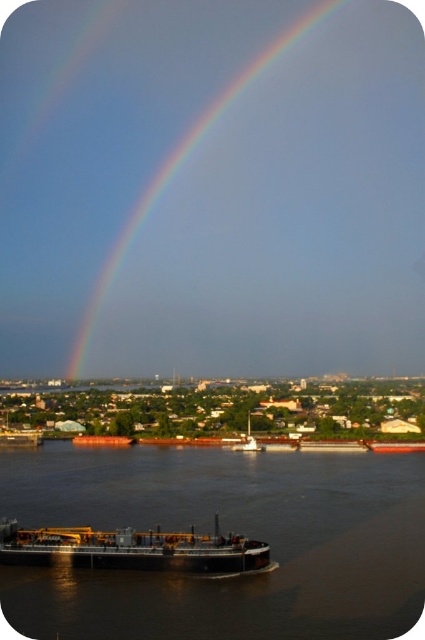
Can you confirm if black matte barge at lower center is shorter than rainbow at upper center?

Yes.

Who is more distant from viewer, (271, 568) or (195, 140)?

The point (195, 140) is behind.

Who is more forward, (263,570) or (320,13)?

Point (263,570) is more forward.

Identify the location of black matte barge at lower center. (135, 548).

Who is positioned more to the right, black matte water at center or rainbow at upper center?

black matte water at center is more to the right.

Identify the location of black matte water at center. The height and width of the screenshot is (640, 425). (226, 531).

Is point (20, 515) positioned before point (73, 378)?

Yes, point (20, 515) is in front of point (73, 378).

You are a GUI agent. You are given a task and a screenshot of the screen. Output one action in this format:
    pyautogui.click(x=<x>, y=<y>)
    Task: Click on the black matte water at center
    The height and width of the screenshot is (640, 425).
    Given the screenshot: What is the action you would take?
    pyautogui.click(x=226, y=531)

Is black matte water at center to the right of black matte barge at lower center from the viewer's perspective?

Correct, you'll find black matte water at center to the right of black matte barge at lower center.

Between point (257, 465) and point (150, 557), which one is positioned behind?

The point (257, 465) is behind.

What do you see at coordinates (226, 531) in the screenshot?
I see `black matte water at center` at bounding box center [226, 531].

Where is `black matte water at center`? The height and width of the screenshot is (640, 425). black matte water at center is located at coordinates (226, 531).